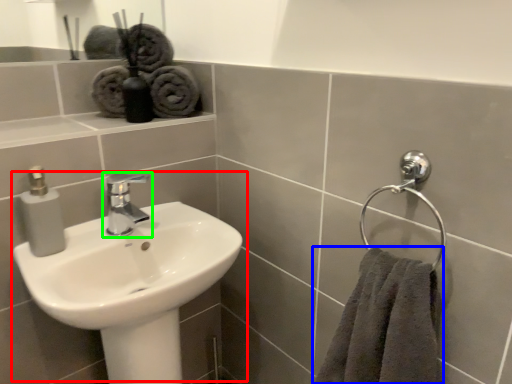
Question: Considering the real-world distances, which object is closest to sink (highlighted by a red box)? towel (highlighted by a blue box) or tap (highlighted by a green box).

Choices:
 (A) towel
 (B) tap

Answer: (B)